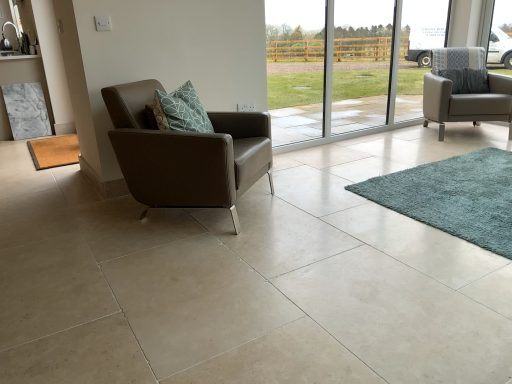
Question: Is transparent glass door at center surrounding teal shaggy rug at lower right, positioned as the 1th mat in right-to-left order?

Choices:
 (A) no
 (B) yes

Answer: (A)

Question: Considering the relative positions of transparent glass door at center and teal shaggy rug at lower right, which appears as the 2th mat when viewed from the left, in the image provided, is transparent glass door at center to the left of teal shaggy rug at lower right, which appears as the 2th mat when viewed from the left, from the viewer's perspective?

Choices:
 (A) no
 (B) yes

Answer: (B)

Question: From a real-world perspective, is transparent glass door at center beneath teal shaggy rug at lower right, the 2th mat positioned from the back?

Choices:
 (A) no
 (B) yes

Answer: (A)

Question: Is transparent glass door at center positioned beyond the bounds of teal shaggy rug at lower right, the 2th mat positioned from the back?

Choices:
 (A) no
 (B) yes

Answer: (B)

Question: Considering the relative sizes of transparent glass door at center and teal shaggy rug at lower right, the 2th mat positioned from the back, in the image provided, is transparent glass door at center wider than teal shaggy rug at lower right, the 2th mat positioned from the back,?

Choices:
 (A) no
 (B) yes

Answer: (A)

Question: Does transparent glass door at center have a greater height compared to teal shaggy rug at lower right, the first mat positioned from the front?

Choices:
 (A) no
 (B) yes

Answer: (B)

Question: Is teal shaggy rug at lower right, positioned as the 1th mat in right-to-left order, oriented towards brown leather armchair at left, which appears as the second chair when viewed from the right?

Choices:
 (A) yes
 (B) no

Answer: (B)

Question: From a real-world perspective, is teal shaggy rug at lower right, the first mat positioned from the front, physically above brown leather armchair at left, which appears as the second chair when viewed from the right?

Choices:
 (A) no
 (B) yes

Answer: (A)

Question: Is teal shaggy rug at lower right, which appears as the 2th mat when viewed from the left, thinner than brown leather armchair at left, marked as the 1th chair in a left-to-right arrangement?

Choices:
 (A) yes
 (B) no

Answer: (B)

Question: From a real-world perspective, is teal shaggy rug at lower right, which appears as the 2th mat when viewed from the left, positioned under brown leather armchair at left, marked as the 1th chair in a left-to-right arrangement, based on gravity?

Choices:
 (A) yes
 (B) no

Answer: (A)

Question: Can you confirm if teal shaggy rug at lower right, positioned as the 1th mat in right-to-left order, is wider than brown leather armchair at left, which appears as the second chair when viewed from the right?

Choices:
 (A) yes
 (B) no

Answer: (A)

Question: Is teal shaggy rug at lower right, the 2th mat positioned from the back, not within brown leather armchair at left, positioned as the 1th chair in front-to-back order?

Choices:
 (A) yes
 (B) no

Answer: (A)

Question: Can you confirm if matte gray armchair at right, acting as the second chair starting from the left, is wider than transparent glass door at center?

Choices:
 (A) yes
 (B) no

Answer: (A)